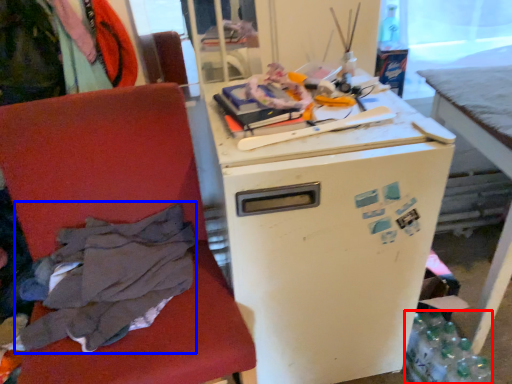
Question: Which object is closer to the camera taking this photo, bottle (highlighted by a red box) or clothing (highlighted by a blue box)?

Choices:
 (A) bottle
 (B) clothing

Answer: (B)